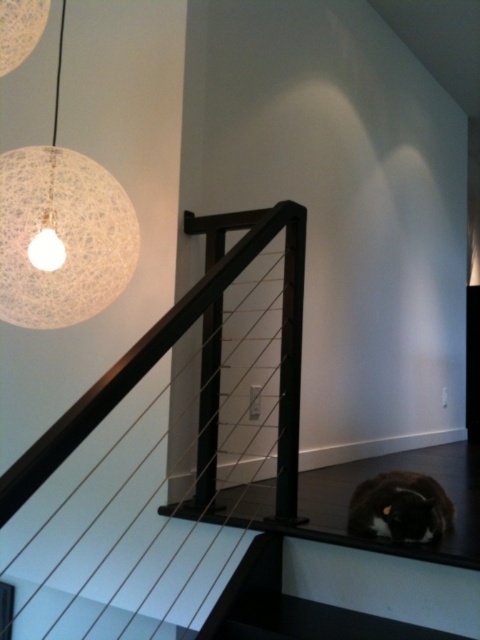
Find the location of a particular element. black matte rail at upper left is located at coordinates (167, 454).

Which is above, black matte rail at upper left or black fur cat at lower right?

Positioned higher is black fur cat at lower right.

Does point (257, 212) come closer to viewer compared to point (411, 528)?

No, it is not.

Where is `black matte rail at upper left`? This screenshot has width=480, height=640. black matte rail at upper left is located at coordinates (167, 454).

Between point (48, 516) and point (126, 198), which one is positioned in front?

Point (126, 198) is more forward.

Where is `black matte rail at upper left`? black matte rail at upper left is located at coordinates (167, 454).

From the picture: Measure the distance from white textured sphere at upper left to black fur cat at lower right.

A distance of 1.01 meters exists between white textured sphere at upper left and black fur cat at lower right.

Between white textured sphere at upper left and black fur cat at lower right, which one is positioned higher?

white textured sphere at upper left is higher up.

This screenshot has height=640, width=480. Identify the location of white textured sphere at upper left. (61, 234).